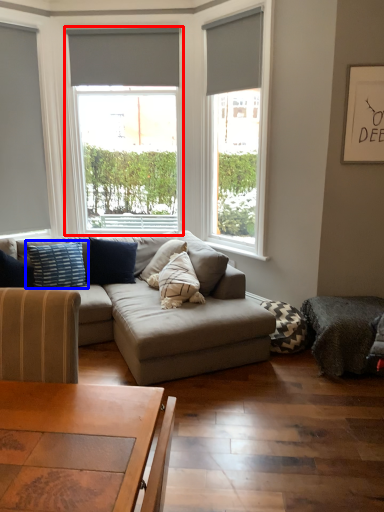
Question: Which of the following is the closest to the observer, window (highlighted by a red box) or pillow (highlighted by a blue box)?

Choices:
 (A) window
 (B) pillow

Answer: (B)